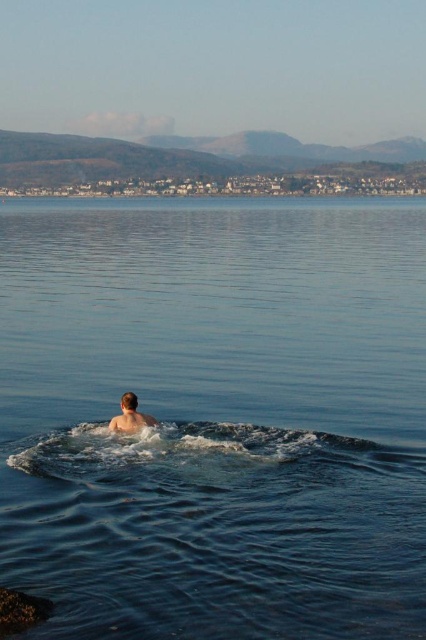
Question: Is clear blue water at center smaller than light brown skin at center?

Choices:
 (A) no
 (B) yes

Answer: (A)

Question: Which point appears farthest from the camera in this image?

Choices:
 (A) (127, 428)
 (B) (402, 339)

Answer: (B)

Question: Which of the following is the closest to the observer?

Choices:
 (A) (124, 413)
 (B) (78, 634)

Answer: (B)

Question: Where is clear blue water at center located in relation to light brown skin at center in the image?

Choices:
 (A) above
 (B) below

Answer: (A)

Question: Where is clear blue water at center located in relation to light brown skin at center in the image?

Choices:
 (A) left
 (B) right

Answer: (A)